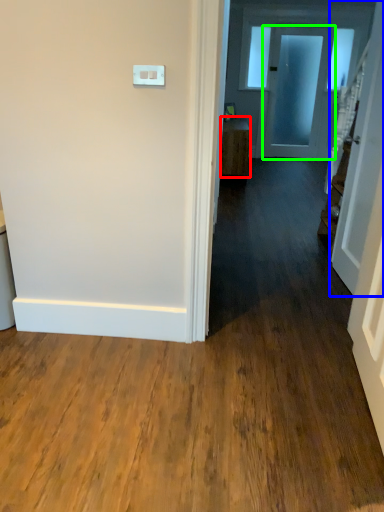
Question: Which object is positioned closest to furniture (highlighted by a red box)? Select from door (highlighted by a blue box) and door (highlighted by a green box).

Choices:
 (A) door
 (B) door

Answer: (B)